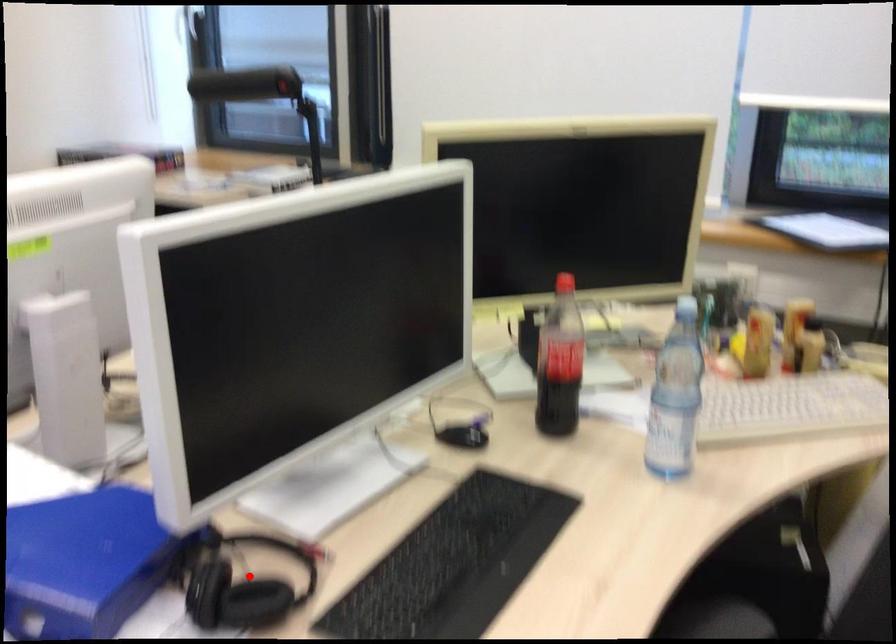
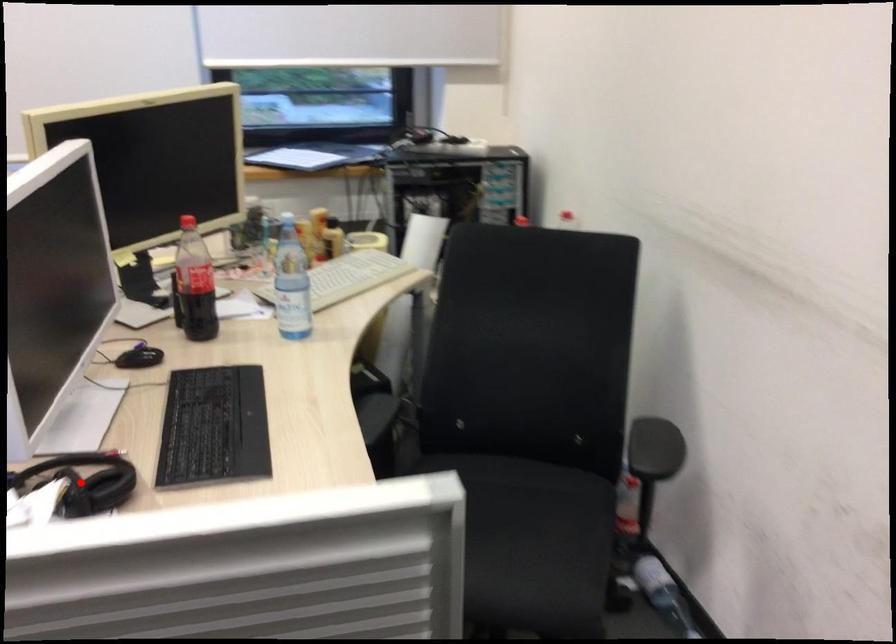
From the picture: I am providing you with two images of the same scene from different viewpoints. A red point is marked on the first image and another point is marked on the second image. Is the red point in image1 aligned with the point shown in image2?

Yes